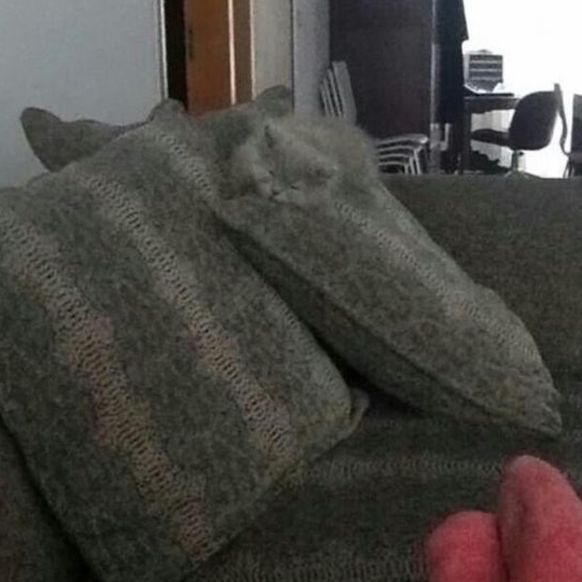
At what (x,y) coordinates should I click in order to perform the action: click on wall. Please return your answer as a coordinate pair (x, y). The width and height of the screenshot is (582, 582). Looking at the image, I should click on (120, 27).